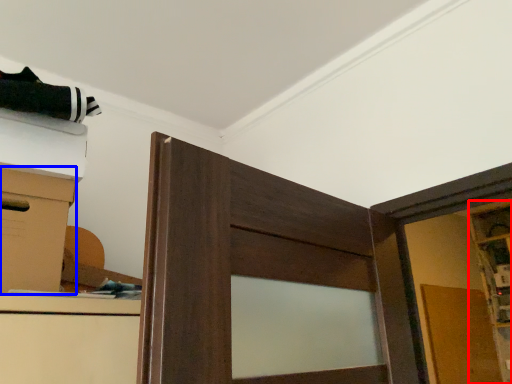
Question: Which object is closer to the camera taking this photo, cabinetry (highlighted by a red box) or cardboard box (highlighted by a blue box)?

Choices:
 (A) cabinetry
 (B) cardboard box

Answer: (B)